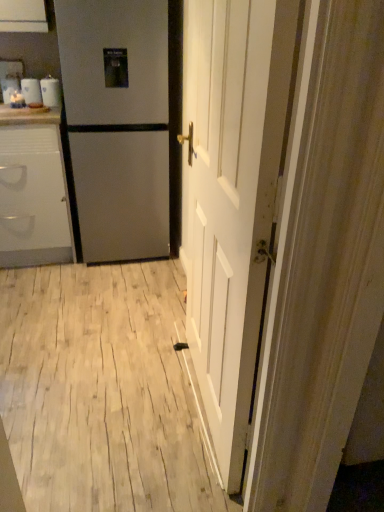
Question: Is white glossy mugs at upper left bigger or smaller than white wood floor at center?

Choices:
 (A) small
 (B) big

Answer: (A)

Question: Visually, is white glossy mugs at upper left positioned to the left or to the right of white wood floor at center?

Choices:
 (A) left
 (B) right

Answer: (A)

Question: Which object is the farthest from the white glossy counter top at upper left?

Choices:
 (A) white wood floor at center
 (B) white wooden door at center
 (C) white glossy mugs at upper left
 (D) satin silver refrigerator at left
 (E) white glossy cabinet at left

Answer: (B)

Question: Estimate the real-world distances between objects in this image. Which object is farther from the white wood floor at center?

Choices:
 (A) white glossy cabinet at left
 (B) white wooden door at center
 (C) satin silver refrigerator at left
 (D) white glossy mugs at upper left
 (E) white glossy counter top at upper left

Answer: (D)